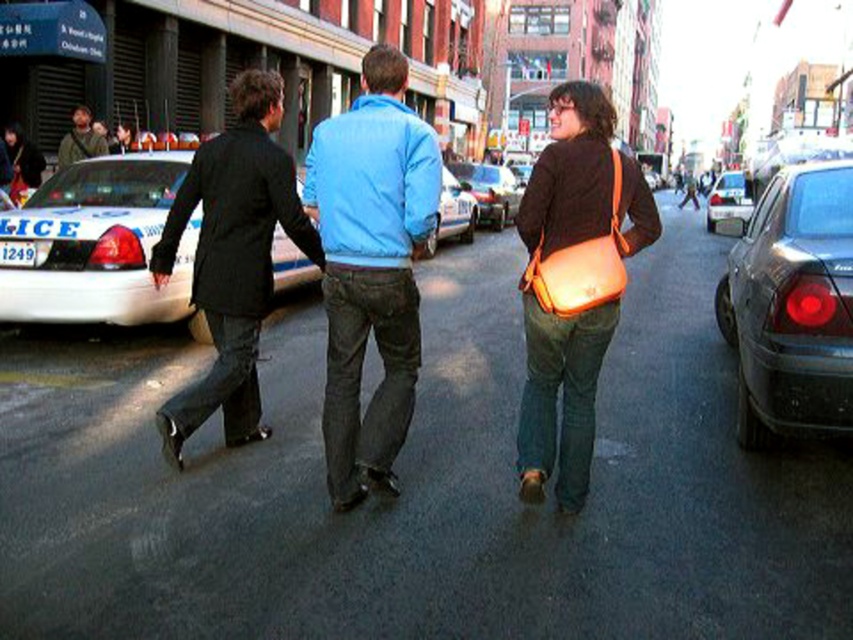
You are a pedestrian standing on the sidewalk and see the white glossy police car at left and the metallic blue sedan at center. Which vehicle is closer to the sidewalk?

The white glossy police car at left is closer to the sidewalk because it is positioned to the left of the metallic blue sedan at center, which is further away from the sidewalk.

You are standing at the origin point of the coordinate system in the image. The black matte suit at left is located at point (231, 259). If you want to walk towards the black matte suit at left, which direction should you move in terms of x and y coordinates?

To reach the black matte suit at left located at point (231, 259), you should move in the positive x and positive y direction since the coordinates are both higher than the origin.

You are standing at the camera position and want to throw a ball to a friend who is at point (79,284). There is an obstacle at point (161,419). Will the ball pass over the obstacle?

Point (161,419) is closer to the camera than point (79,284), so the ball will hit the obstacle at point (161,419) before reaching your friend.